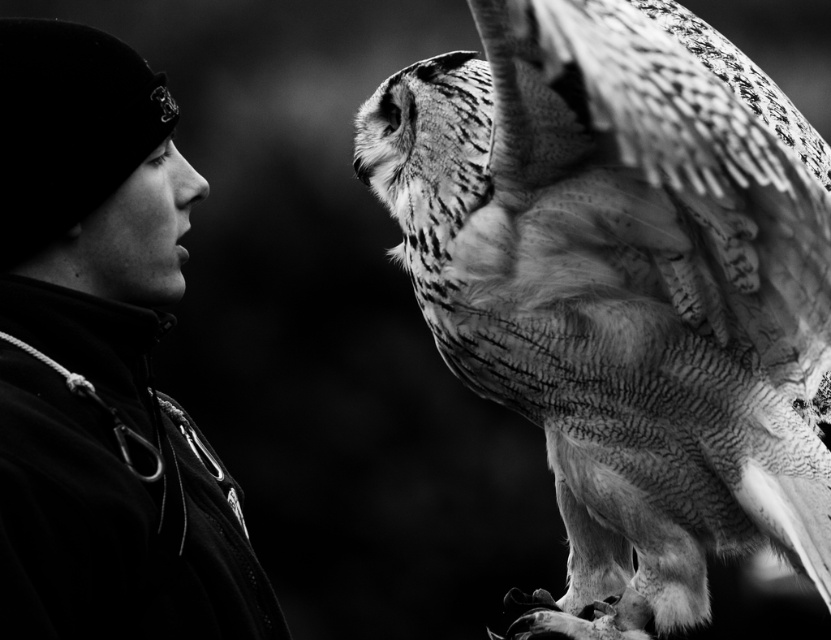
In the scene shown: Which is below, speckled feathered owl at right or dark fabric jacket at left?

dark fabric jacket at left is lower down.

Is speckled feathered owl at right to the left of dark fabric jacket at left from the viewer's perspective?

In fact, speckled feathered owl at right is to the right of dark fabric jacket at left.

Is point (748, 182) more distant than point (194, 524)?

Yes, point (748, 182) is behind point (194, 524).

Identify the location of speckled feathered owl at right. This screenshot has height=640, width=831. (623, 288).